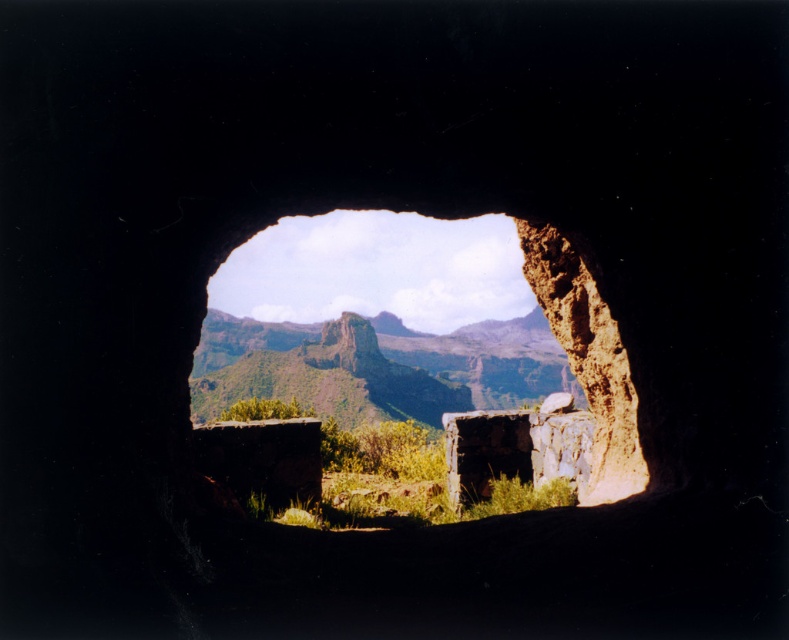
Question: Is the position of brown rocky cave at center less distant than that of green grassy mountain at center?

Choices:
 (A) no
 (B) yes

Answer: (B)

Question: Can you confirm if brown rocky cave at center is positioned above green grassy mountain at center?

Choices:
 (A) no
 (B) yes

Answer: (B)

Question: Among these points, which one is farthest from the camera?

Choices:
 (A) click(x=399, y=353)
 (B) click(x=288, y=397)

Answer: (A)

Question: Is brown rocky cave at center smaller than green grassy mountain at center?

Choices:
 (A) yes
 (B) no

Answer: (A)